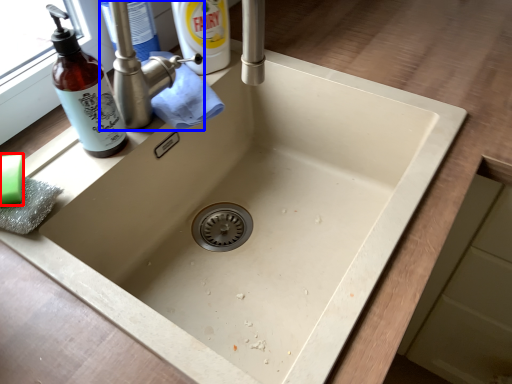
Question: Which object is closer to the camera taking this photo, soap (highlighted by a red box) or tap (highlighted by a blue box)?

Choices:
 (A) soap
 (B) tap

Answer: (A)